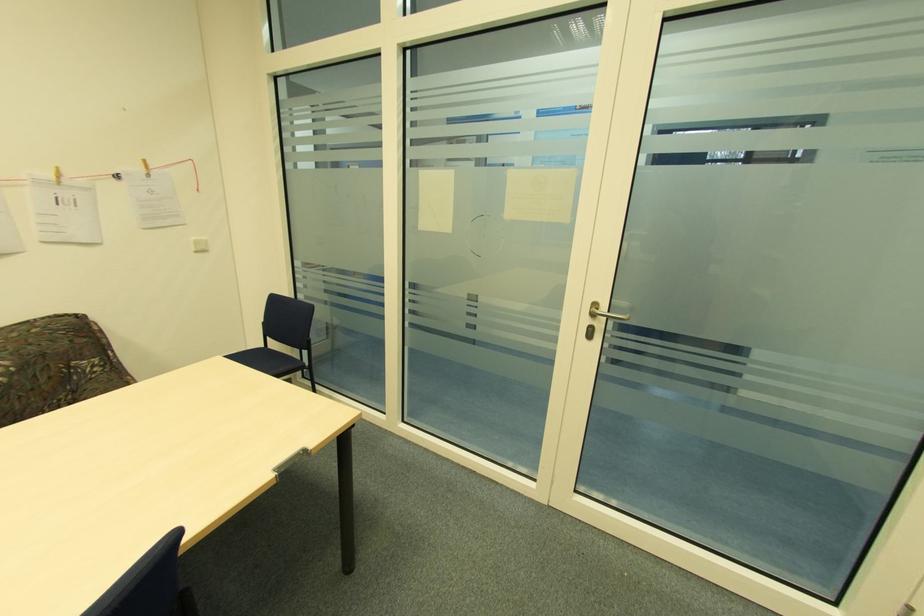
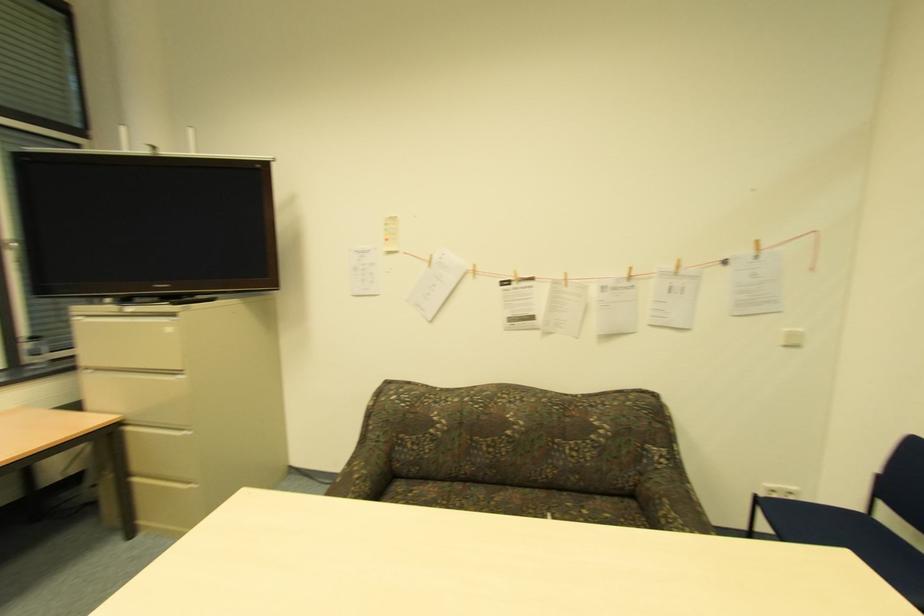
Where in the second image is the point corresponding to the point at 199,243 from the first image?

(792, 334)